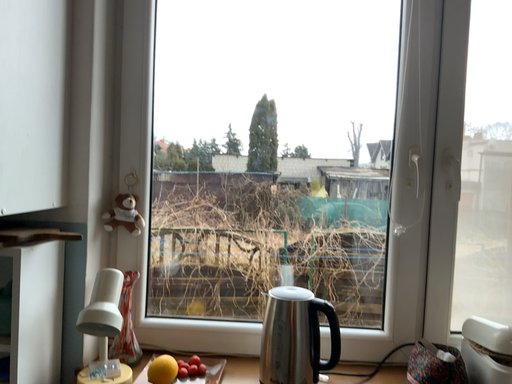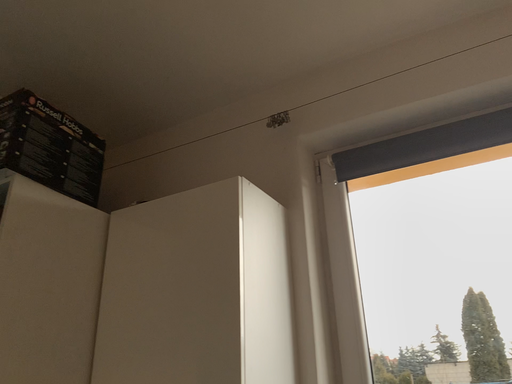
Question: How did the camera likely rotate when shooting the video?

Choices:
 (A) rotated downward
 (B) rotated upward

Answer: (B)